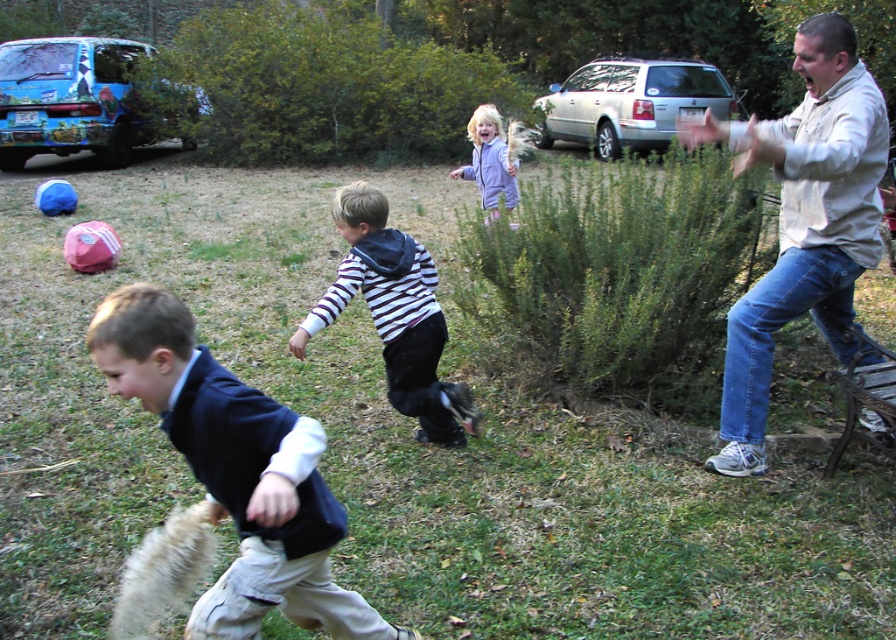
Does dark blue sweater at lower left lie behind beige cotton shirt at right?

No.

Which of these two, dark blue sweater at lower left or beige cotton shirt at right, stands taller?

Standing taller between the two is beige cotton shirt at right.

Describe the element at coordinates (237, 472) in the screenshot. I see `dark blue sweater at lower left` at that location.

Locate an element on the screen. The height and width of the screenshot is (640, 896). dark blue sweater at lower left is located at coordinates (x=237, y=472).

Is striped hoodie at center positioned behind purple fleece jacket at upper center?

No, it is in front of purple fleece jacket at upper center.

Does point (363, 260) come farther from viewer compared to point (488, 204)?

No, it is not.

At what (x,y) coordinates should I click in order to perform the action: click on striped hoodie at center. Please return your answer as a coordinate pair (x, y). This screenshot has height=640, width=896. Looking at the image, I should click on (394, 314).

Is beige cotton shirt at right shorter than purple fleece jacket at upper center?

No.

Image resolution: width=896 pixels, height=640 pixels. I want to click on beige cotton shirt at right, so click(802, 221).

Is point (831, 88) less distant than point (461, 164)?

Yes.

Locate an element on the screen. beige cotton shirt at right is located at coordinates (802, 221).